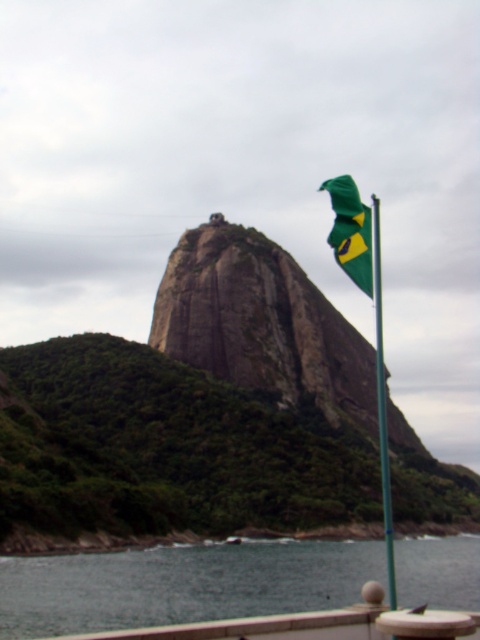
Who is higher up, smooth water at lower center or green fabric flag at upper right?

green fabric flag at upper right is above.

Does smooth water at lower center appear on the right side of green fabric flag at upper right?

Incorrect, smooth water at lower center is not on the right side of green fabric flag at upper right.

Locate an element on the screen. The image size is (480, 640). smooth water at lower center is located at coordinates (180, 582).

You are a GUI agent. You are given a task and a screenshot of the screen. Output one action in this format:
    pyautogui.click(x=<x>, y=<y>)
    Task: Click on the smooth water at lower center
    
    Given the screenshot: What is the action you would take?
    pyautogui.click(x=180, y=582)

Is green fabric flag at upper right smaller than green fabric flag at right?

Yes.

Identify the location of green fabric flag at upper right. (350, 230).

Identify the location of green fabric flag at upper right. The image size is (480, 640). click(x=350, y=230).

Locate an element on the screen. green fabric flag at upper right is located at coordinates [350, 230].

Who is more forward, (x=278, y=451) or (x=375, y=324)?

Point (x=278, y=451) is more forward.

Between green rock at center and green fabric flag at right, which one has less height?

Standing shorter between the two is green fabric flag at right.

What do you see at coordinates (166, 448) in the screenshot? I see `green rock at center` at bounding box center [166, 448].

This screenshot has width=480, height=640. In order to click on green rock at center in this screenshot , I will do `click(166, 448)`.